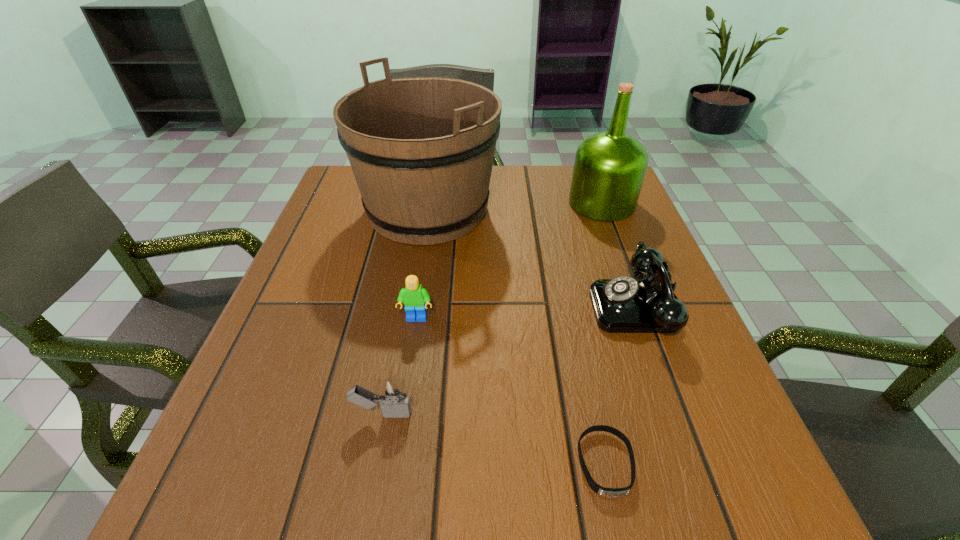
You are a GUI agent. You are given a task and a screenshot of the screen. Output one action in this format:
    pyautogui.click(x=<x>, y=<y>)
    Task: Click on the vacant area located on the dial of the telephone
    This screenshot has width=960, height=540.
    Given the screenshot: What is the action you would take?
    pyautogui.click(x=426, y=306)

At what (x,y) coordinates should I click in order to perform the action: click on blank space located 0.390m on the dial of the telephone. Please return your answer as a coordinate pair (x, y). Looking at the image, I should click on (391, 306).

Where is `vacant region located 0.310m on the dial of the telephone`? The image size is (960, 540). vacant region located 0.310m on the dial of the telephone is located at coordinates (432, 306).

You are a GUI agent. You are given a task and a screenshot of the screen. Output one action in this format:
    pyautogui.click(x=<x>, y=<y>)
    Task: Click on the free location located on the left of the fifth farthest object
    The height and width of the screenshot is (540, 960).
    Given the screenshot: What is the action you would take?
    pyautogui.click(x=315, y=414)

What are the coordinates of `bucket present at the far edge` in the screenshot? It's located at (421, 149).

This screenshot has width=960, height=540. I want to click on olive oil positioned at the far edge, so 609,168.

Identify the location of object located in the near edge section of the desktop. The height and width of the screenshot is (540, 960). (606, 492).

Find the location of `object at the left edge`. object at the left edge is located at coordinates (421, 149).

Where is `olive oil at the right edge`? olive oil at the right edge is located at coordinates (609, 168).

You are a GUI agent. You are given a task and a screenshot of the screen. Output one action in this format:
    pyautogui.click(x=<x>, y=<y>)
    Task: Click on the telephone located in the right edge section of the desktop
    The image size is (960, 540).
    Given the screenshot: What is the action you would take?
    pyautogui.click(x=624, y=304)